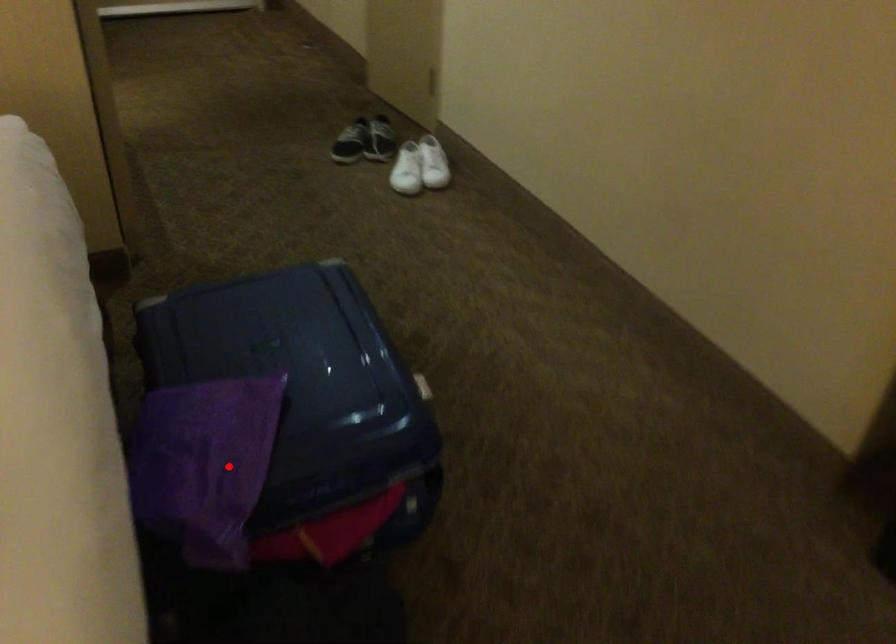
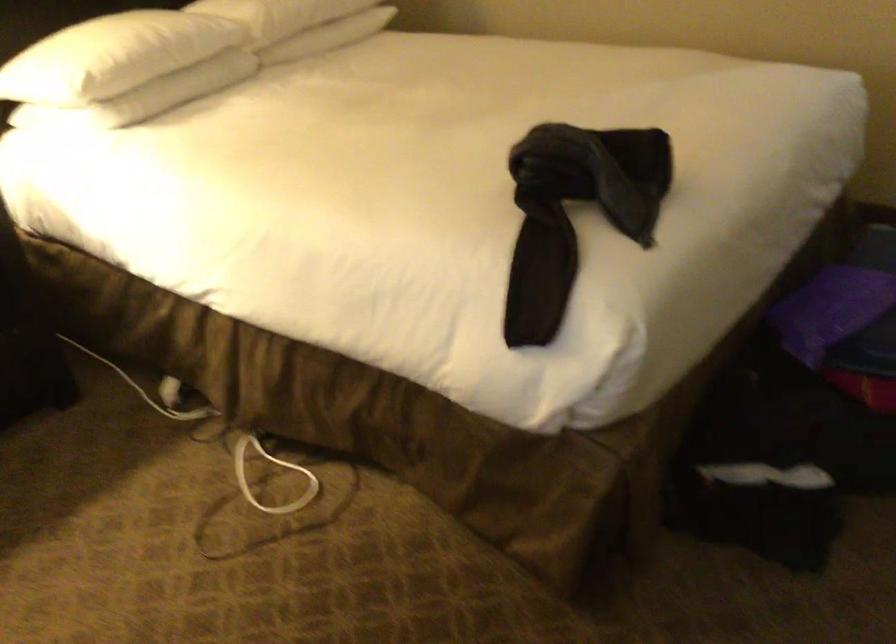
Locate, in the second image, the point that corresponds to the highlighted location in the first image.

(831, 310)